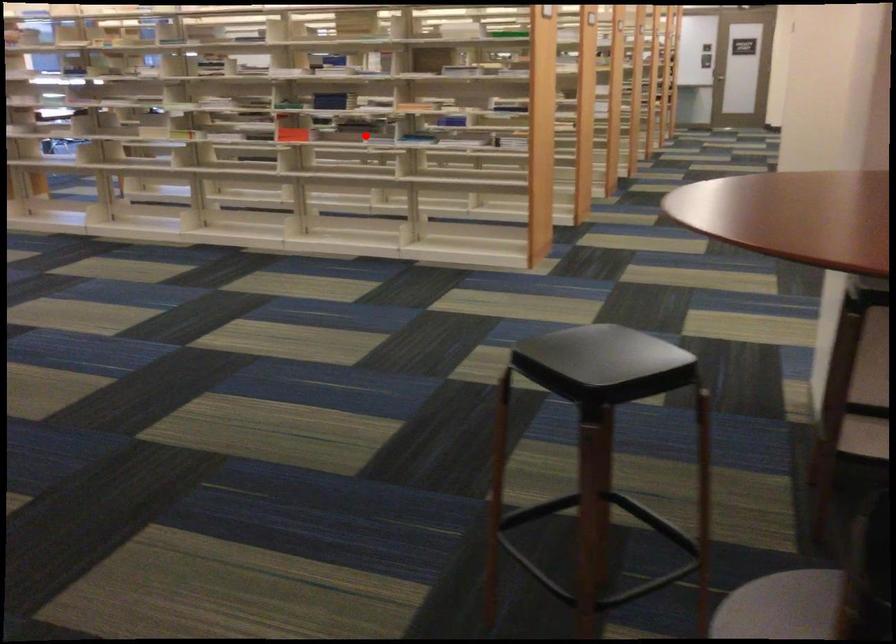
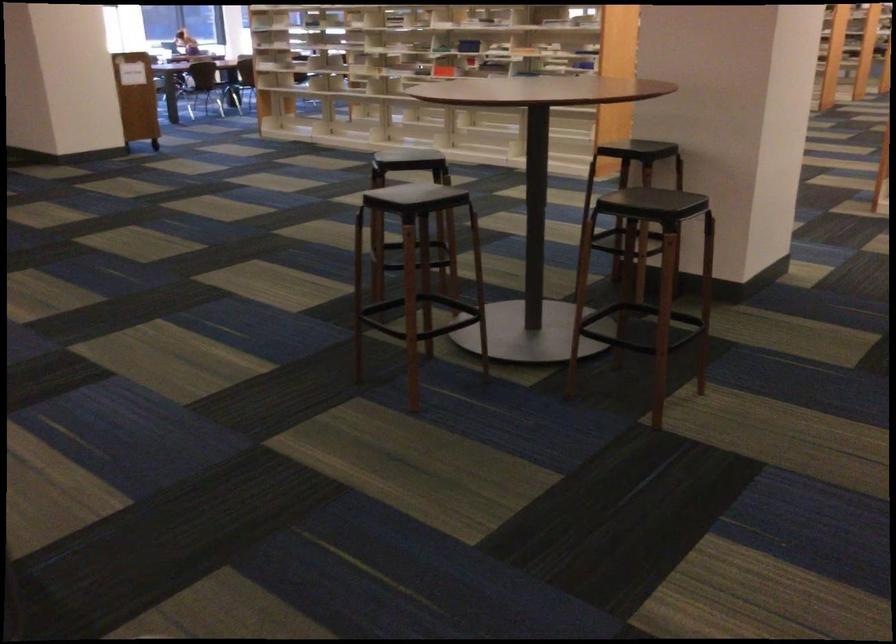
Locate, in the second image, the point that corresponds to the highlighted location in the first image.

(469, 46)